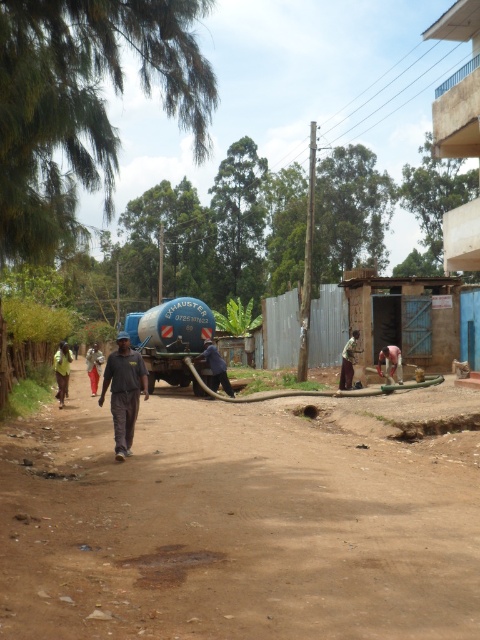
Does brown dirt field at center have a greater height compared to dark blue fabric at center?

In fact, brown dirt field at center may be shorter than dark blue fabric at center.

Based on the photo, is brown dirt field at center behind dark blue fabric at center?

That is False.

What do you see at coordinates (233, 525) in the screenshot?
I see `brown dirt field at center` at bounding box center [233, 525].

Find the location of a particular element. brown dirt field at center is located at coordinates (233, 525).

Who is positioned more to the right, brown dirt field at center or light brown fabric shirt at lower right?

From the viewer's perspective, light brown fabric shirt at lower right appears more on the right side.

Between point (393, 557) and point (344, 385), which one is positioned behind?

The point (344, 385) is more distant.

The height and width of the screenshot is (640, 480). Find the location of `brown dirt field at center`. brown dirt field at center is located at coordinates (233, 525).

Is light brown fabric shirt at lower right above dark gray fabric pants at center?

Yes, light brown fabric shirt at lower right is above dark gray fabric pants at center.

Does light brown fabric shirt at lower right have a smaller size compared to dark gray fabric pants at center?

Indeed, light brown fabric shirt at lower right has a smaller size compared to dark gray fabric pants at center.

Is point (342, 358) farther from camera compared to point (93, 368)?

No, it is not.

This screenshot has width=480, height=640. I want to click on light brown fabric shirt at lower right, so click(x=348, y=362).